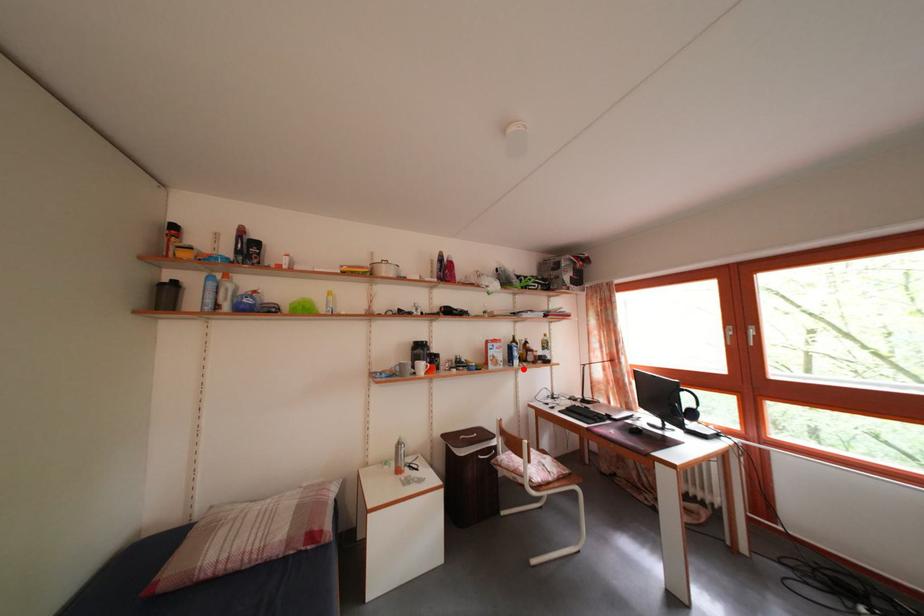
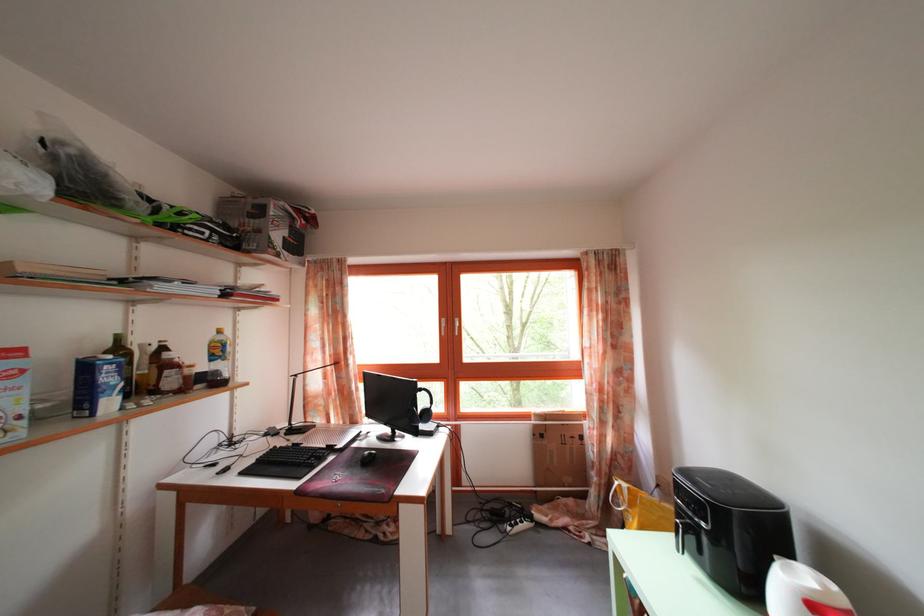
Find the pixel in the second image that matches the highlighted location in the first image.

(117, 410)